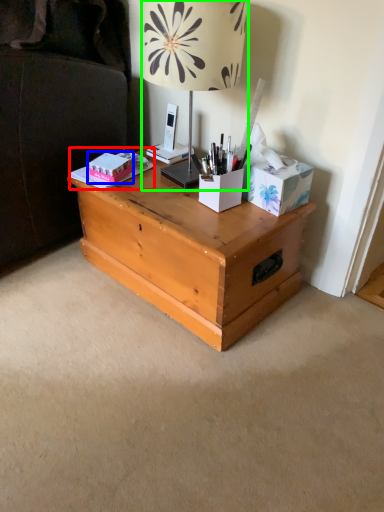
Question: Which object is the closest to the book (highlighted by a red box)? Choose among these: box (highlighted by a blue box) or lamp (highlighted by a green box).

Choices:
 (A) box
 (B) lamp

Answer: (A)